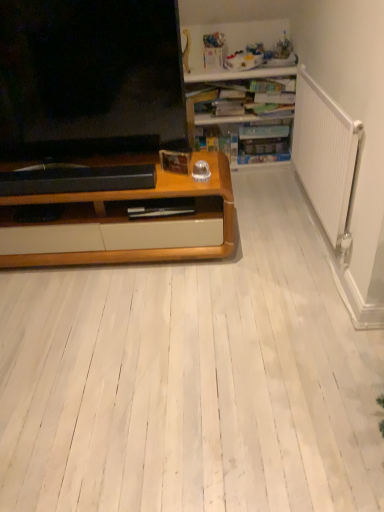
What do you see at coordinates (245, 113) in the screenshot? The image size is (384, 512). I see `wooden desk at upper right` at bounding box center [245, 113].

Locate an element on the screen. The height and width of the screenshot is (512, 384). wooden desk at upper right is located at coordinates pyautogui.click(x=245, y=113).

The image size is (384, 512). Find the location of `matte black television at left`. matte black television at left is located at coordinates (90, 77).

The width and height of the screenshot is (384, 512). Describe the element at coordinates (90, 77) in the screenshot. I see `matte black television at left` at that location.

At what (x,y) coordinates should I click in order to perform the action: click on wooden desk at upper right. Please return your answer as a coordinate pair (x, y). This screenshot has height=512, width=384. Looking at the image, I should click on (245, 113).

In the scene shown: Is matte black television at left to the left of wooden desk at upper right from the viewer's perspective?

Indeed, matte black television at left is positioned on the left side of wooden desk at upper right.

Who is more distant, matte black television at left or wooden desk at upper right?

wooden desk at upper right is behind.

Looking at this image, which is closer, [111,118] or [235,121]?

The point [111,118] is closer to the camera.

Consider the image. From the image's perspective, is matte black television at left above or below wooden desk at upper right?

Clearly, from the image's perspective, matte black television at left is below wooden desk at upper right.

From a real-world perspective, is matte black television at left above or below wooden desk at upper right?

In terms of real-world spatial position, matte black television at left is above wooden desk at upper right.

Looking at their sizes, would you say matte black television at left is wider or thinner than wooden desk at upper right?

Considering their sizes, matte black television at left looks slimmer than wooden desk at upper right.

Is matte black television at left shorter than wooden desk at upper right?

No, matte black television at left is not shorter than wooden desk at upper right.

Is matte black television at left bigger or smaller than wooden desk at upper right?

Considering their sizes, matte black television at left takes up less space than wooden desk at upper right.

Which is correct: matte black television at left is inside wooden desk at upper right, or outside of it?

matte black television at left is spatially situated outside wooden desk at upper right.

Is matte black television at left far away from wooden desk at upper right?

No, there isn't a large distance between matte black television at left and wooden desk at upper right.

Is matte black television at left oriented away from wooden desk at upper right?

Correct, matte black television at left is looking away from wooden desk at upper right.

Measure the distance from matte black television at left to wooden desk at upper right.

37.78 inches.

Image resolution: width=384 pixels, height=512 pixels. Identify the location of television lying in front of the wooden desk at upper right. (90, 77).

Is wooden desk at upper right at the right side of matte black television at left?

Indeed, wooden desk at upper right is positioned on the right side of matte black television at left.

Considering the positions of objects wooden desk at upper right and matte black television at left in the image provided, who is in front, wooden desk at upper right or matte black television at left?

matte black television at left is in front.

Is point (234, 115) behind point (143, 108)?

Yes, it is.

From the image's perspective, who appears lower, wooden desk at upper right or matte black television at left?

matte black television at left.

From a real-world perspective, is wooden desk at upper right below matte black television at left?

Yes.

Consider the image. Considering the relative sizes of wooden desk at upper right and matte black television at left in the image provided, is wooden desk at upper right wider than matte black television at left?

Yes, wooden desk at upper right is wider than matte black television at left.

Between wooden desk at upper right and matte black television at left, which one has less height?

Standing shorter between the two is wooden desk at upper right.

Is wooden desk at upper right bigger or smaller than matte black television at left?

Considering their sizes, wooden desk at upper right takes up more space than matte black television at left.

Can matte black television at left be found inside wooden desk at upper right?

No, matte black television at left is located outside of wooden desk at upper right.

Is wooden desk at upper right beside matte black television at left?

No, wooden desk at upper right is not beside matte black television at left.

Is wooden desk at upper right oriented towards matte black television at left?

No, wooden desk at upper right does not turn towards matte black television at left.

Can you tell me how much wooden desk at upper right and matte black television at left differ in facing direction?

They differ by 0.307 degrees in their facing directions.

Where is `desk behind the matte black television at left`? This screenshot has width=384, height=512. desk behind the matte black television at left is located at coordinates (245, 113).

Locate an element on the screen. desk located behind the matte black television at left is located at coordinates (245, 113).

The width and height of the screenshot is (384, 512). Find the location of `television that is below the wooden desk at upper right (from the image's perspective)`. television that is below the wooden desk at upper right (from the image's perspective) is located at coordinates (90, 77).